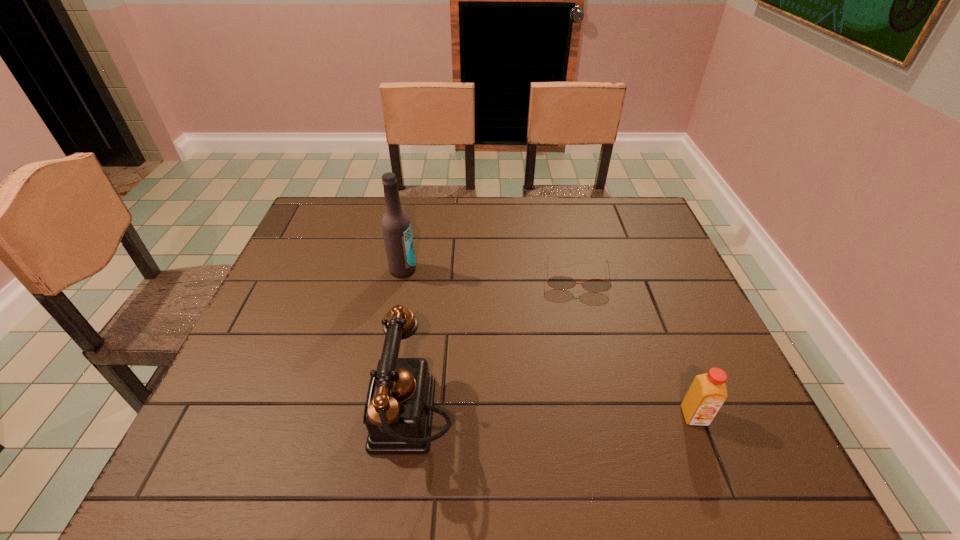
Identify the location of telephone. The image size is (960, 540). (398, 413).

Identify the location of the second shortest object. This screenshot has height=540, width=960. (706, 395).

This screenshot has width=960, height=540. I want to click on orange juice, so click(706, 395).

At what (x,y) coordinates should I click in order to perform the action: click on beer bottle. Please return your answer as a coordinate pair (x, y). The image size is (960, 540). Looking at the image, I should click on (396, 227).

Locate an element on the screen. the third object from left to right is located at coordinates (558, 282).

The height and width of the screenshot is (540, 960). In order to click on the shortest object in this screenshot , I will do `click(558, 282)`.

Where is `free spot located on the front of the telephone at the rotary dial`? free spot located on the front of the telephone at the rotary dial is located at coordinates (264, 419).

Find the location of a particular element. The width and height of the screenshot is (960, 540). vacant region located 0.240m on the front of the telephone at the rotary dial is located at coordinates (250, 419).

You are a GUI agent. You are given a task and a screenshot of the screen. Output one action in this format:
    pyautogui.click(x=<x>, y=<y>)
    Task: Click on the free space located on the front of the telephone at the rotary dial
    
    Given the screenshot: What is the action you would take?
    pyautogui.click(x=323, y=419)

Identify the location of free space located 0.150m on the label of the tallest object. The image size is (960, 540). (444, 306).